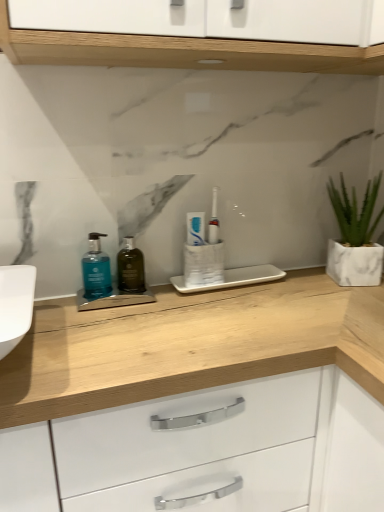
Question: In which direction should I rotate to look at dark green glass bottle at center, the 1th mouthwash when ordered from right to left?

Choices:
 (A) left
 (B) right

Answer: (A)

Question: Is dark green glass bottle at center, the 1th mouthwash when ordered from right to left, a part of white matte tube at center?

Choices:
 (A) no
 (B) yes

Answer: (A)

Question: Is white matte tube at center in front of dark green glass bottle at center, the 1th mouthwash when ordered from right to left?

Choices:
 (A) yes
 (B) no

Answer: (B)

Question: Would you say white matte tube at center is outside dark green glass bottle at center, the 1th mouthwash when ordered from right to left?

Choices:
 (A) no
 (B) yes

Answer: (B)

Question: Considering the relative sizes of white matte tube at center and dark green glass bottle at center, the 1th mouthwash when ordered from right to left, in the image provided, is white matte tube at center wider than dark green glass bottle at center, the 1th mouthwash when ordered from right to left,?

Choices:
 (A) yes
 (B) no

Answer: (B)

Question: Does white matte tube at center have a lesser width compared to dark green glass bottle at center, positioned as the second mouthwash in left-to-right order?

Choices:
 (A) yes
 (B) no

Answer: (A)

Question: Is white matte tube at center facing towards dark green glass bottle at center, positioned as the second mouthwash in left-to-right order?

Choices:
 (A) yes
 (B) no

Answer: (B)

Question: Considering the relative sizes of dark green glass bottle at center, the 1th mouthwash when ordered from right to left, and white matte tube at center in the image provided, is dark green glass bottle at center, the 1th mouthwash when ordered from right to left, wider than white matte tube at center?

Choices:
 (A) yes
 (B) no

Answer: (A)

Question: From a real-world perspective, is dark green glass bottle at center, positioned as the second mouthwash in left-to-right order, over white matte tube at center?

Choices:
 (A) no
 (B) yes

Answer: (A)

Question: Is dark green glass bottle at center, positioned as the second mouthwash in left-to-right order, oriented away from white matte tube at center?

Choices:
 (A) yes
 (B) no

Answer: (B)

Question: Is dark green glass bottle at center, the 1th mouthwash when ordered from right to left, to the left of white matte tube at center from the viewer's perspective?

Choices:
 (A) yes
 (B) no

Answer: (A)

Question: Would you say dark green glass bottle at center, the 1th mouthwash when ordered from right to left, is outside white matte tube at center?

Choices:
 (A) no
 (B) yes

Answer: (B)

Question: Is the surface of dark green glass bottle at center, the 1th mouthwash when ordered from right to left, in direct contact with white matte tube at center?

Choices:
 (A) yes
 (B) no

Answer: (B)

Question: Does white matte tube at center lie behind white marble planter at right?

Choices:
 (A) yes
 (B) no

Answer: (A)